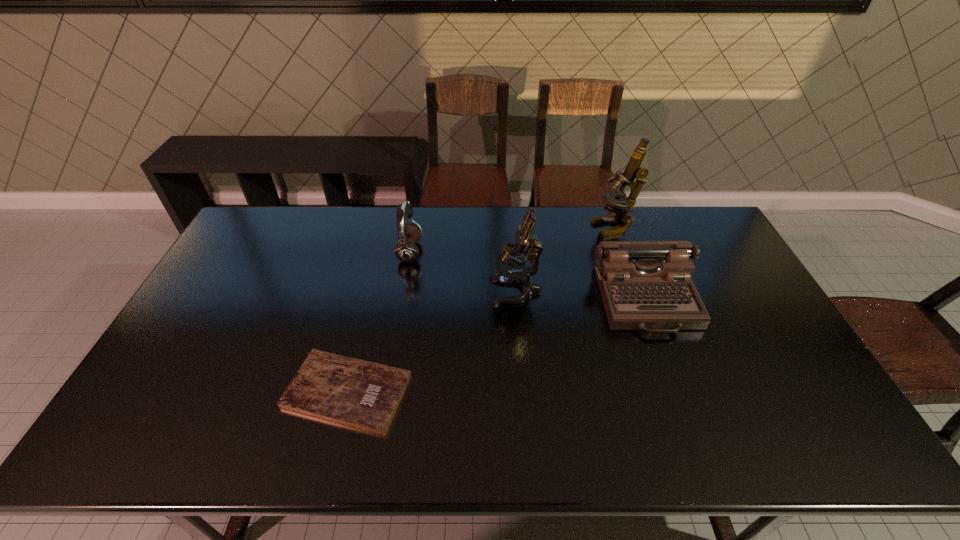
Select which object appears as the second closest to the earphone. Please provide its 2D coordinates. Your answer should be formatted as a tuple, i.e. [(x, y)], where the tuple contains the x and y coordinates of a point satisfying the conditions above.

[(361, 394)]

Where is `vacant region that satisfies the following two spatial constraints: 1. at the eyepieces of the third object from left to right; 2. on the front side of the Bible`? This screenshot has height=540, width=960. vacant region that satisfies the following two spatial constraints: 1. at the eyepieces of the third object from left to right; 2. on the front side of the Bible is located at coordinates (523, 392).

Find the location of a particular element. The width and height of the screenshot is (960, 540). vacant space that satisfies the following two spatial constraints: 1. on the front side of the farther microscope; 2. at the eyepieces of the left microscope is located at coordinates (638, 292).

This screenshot has height=540, width=960. I want to click on free space that satisfies the following two spatial constraints: 1. at the eyepieces of the left microscope; 2. on the front side of the Bible, so click(523, 392).

Image resolution: width=960 pixels, height=540 pixels. I want to click on vacant region that satisfies the following two spatial constraints: 1. on the front side of the right microscope; 2. on the ear pads of the earphone, so (624, 252).